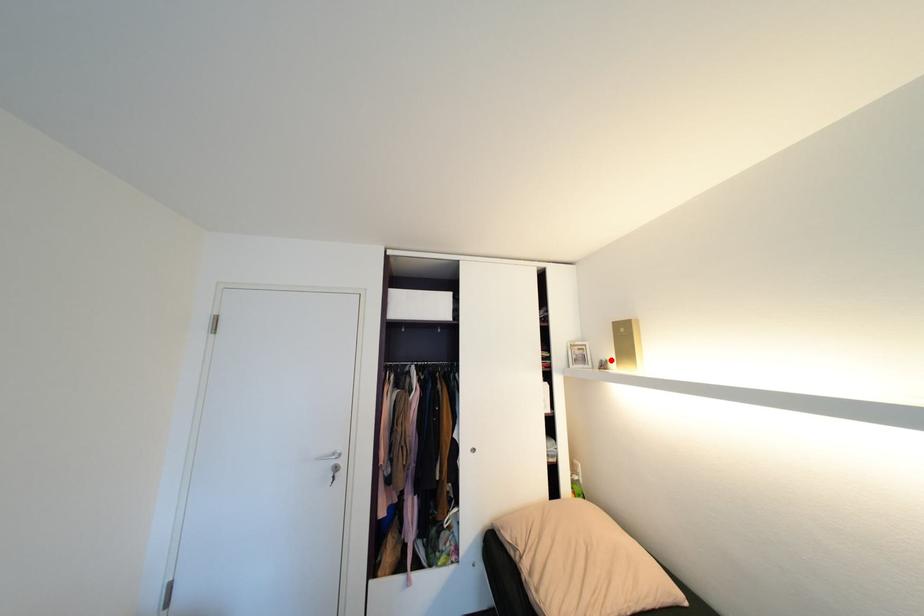
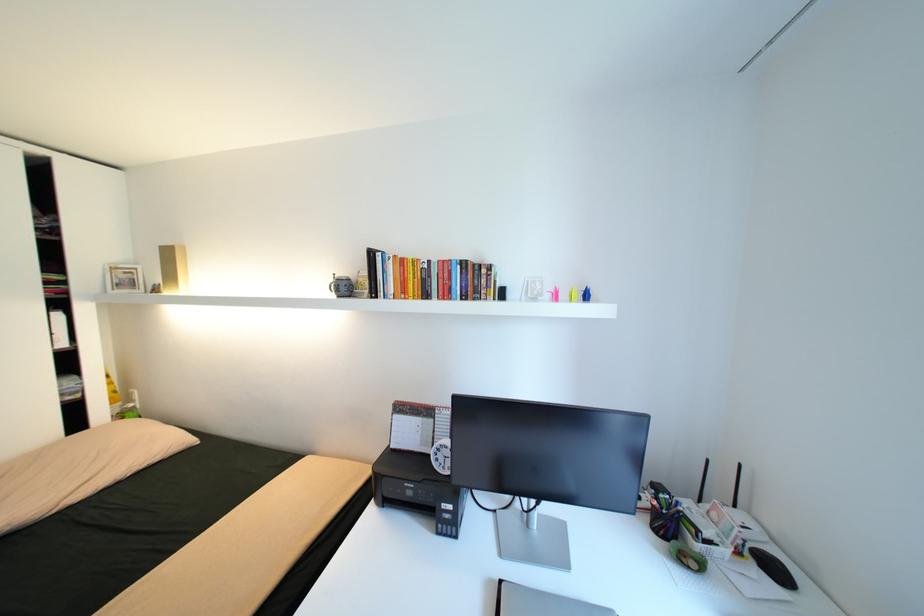
Where in the second image is the point corresponding to the highlighted location from the first image?

(164, 284)